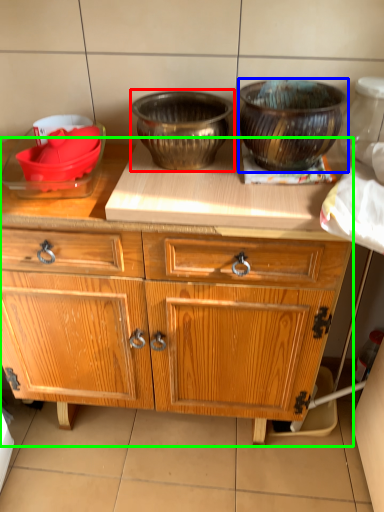
Question: Which object is the closest to the bowl (highlighted by a red box)? Choose among these: bowl (highlighted by a blue box) or cabinetry (highlighted by a green box).

Choices:
 (A) bowl
 (B) cabinetry

Answer: (A)